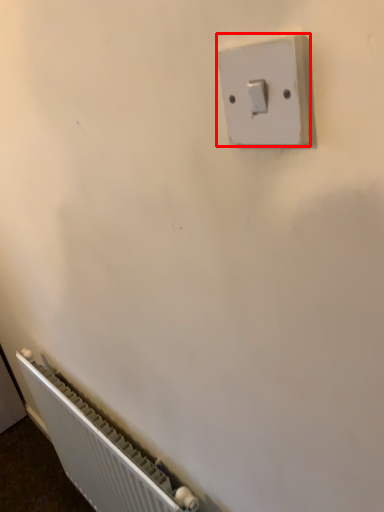
Question: Observing the image, what is the correct spatial positioning of light switch (annotated by the red box) in reference to radiator?

Choices:
 (A) left
 (B) right

Answer: (B)